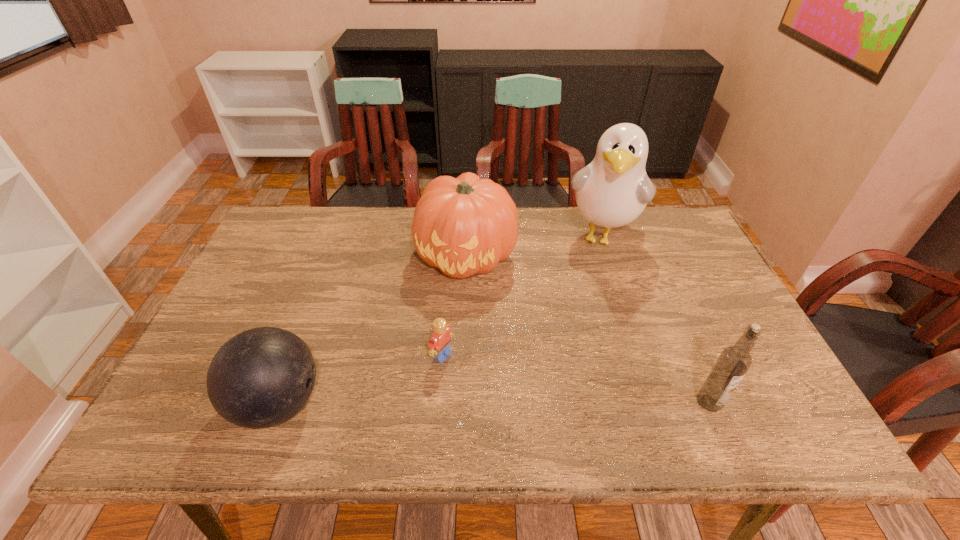
Find the location of `free space on the desktop that is between the leftmost object and the vodka and is positioned on the front-facing side of the Lego`. free space on the desktop that is between the leftmost object and the vodka and is positioned on the front-facing side of the Lego is located at coordinates (520, 403).

What are the coordinates of `vacant space on the desktop that is between the leftmost object and the vodka and is positioned on the carved face of the pumpkin` in the screenshot? It's located at (440, 403).

Where is `vacant space on the desktop that is between the fourth tallest object and the vodka and is positioned on the beak of the gull`? This screenshot has height=540, width=960. vacant space on the desktop that is between the fourth tallest object and the vodka and is positioned on the beak of the gull is located at coordinates (557, 402).